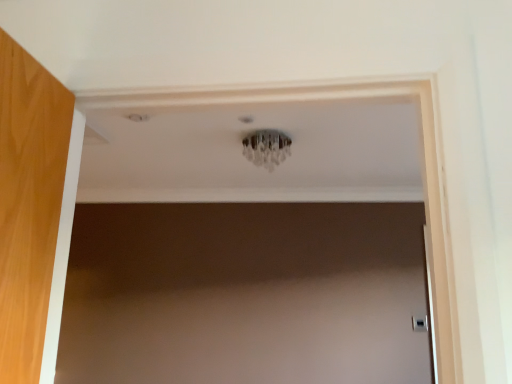
Question: Is point pyautogui.click(x=413, y=319) closer or farther from the camera than point pyautogui.click(x=266, y=153)?

Choices:
 (A) farther
 (B) closer

Answer: (A)

Question: Is satin silver door handle at lower right situated inside clear crystal chandelier at center or outside?

Choices:
 (A) outside
 (B) inside

Answer: (A)

Question: Is satin silver door handle at lower right taller or shorter than clear crystal chandelier at center?

Choices:
 (A) short
 (B) tall

Answer: (A)

Question: Is clear crystal chandelier at center to the left or to the right of satin silver door handle at lower right in the image?

Choices:
 (A) left
 (B) right

Answer: (A)

Question: Do you think clear crystal chandelier at center is within satin silver door handle at lower right, or outside of it?

Choices:
 (A) outside
 (B) inside

Answer: (A)

Question: From a real-world perspective, is clear crystal chandelier at center physically located above or below satin silver door handle at lower right?

Choices:
 (A) below
 (B) above

Answer: (B)

Question: Looking at their shapes, would you say clear crystal chandelier at center is wider or thinner than satin silver door handle at lower right?

Choices:
 (A) thin
 (B) wide

Answer: (B)